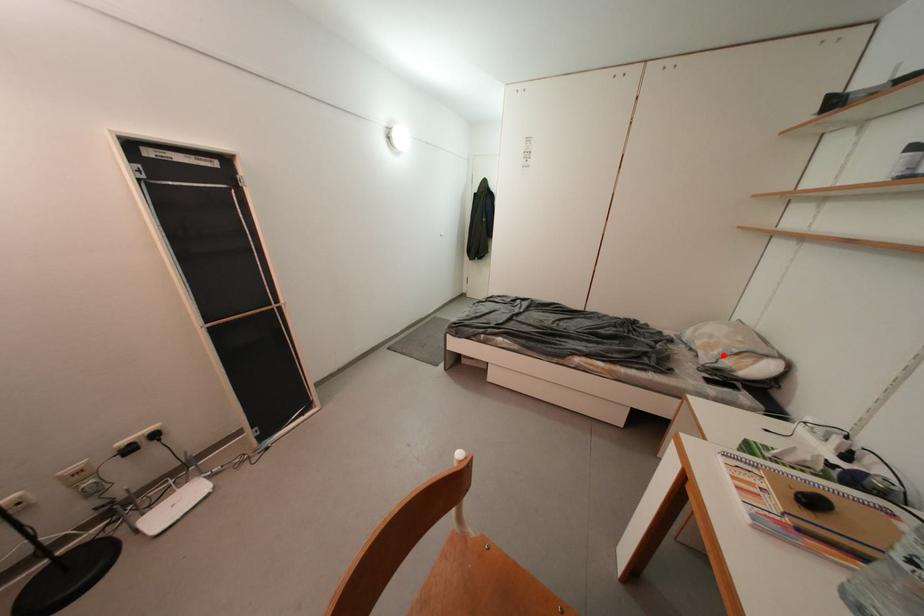
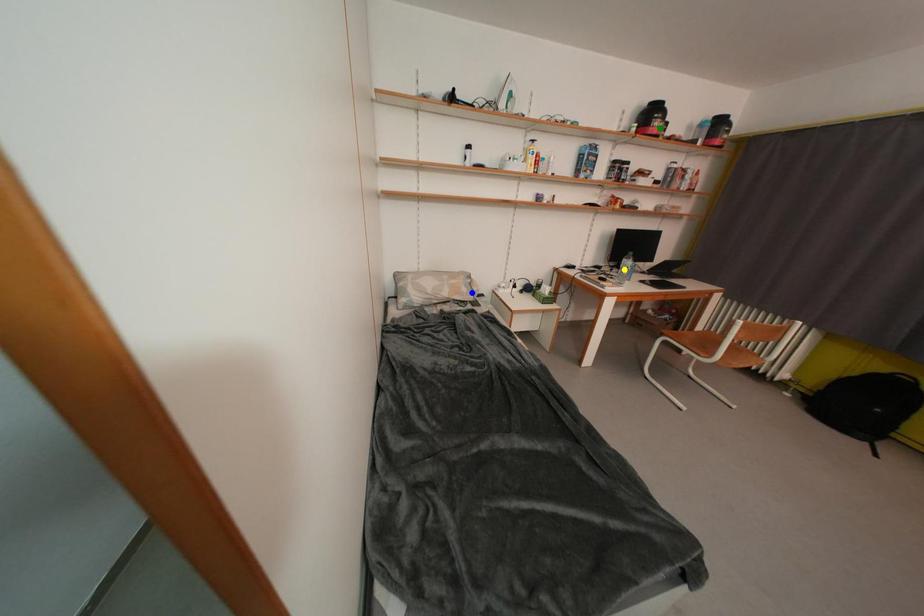
Question: I am providing you with two images of the same scene from different viewpoints. A red point is marked on the first image. You are given multiple points on the second image. Which point in image 2 represents the same 3d spot as the red point in image 1?

Choices:
 (A) green point
 (B) blue point
 (C) yellow point

Answer: (B)